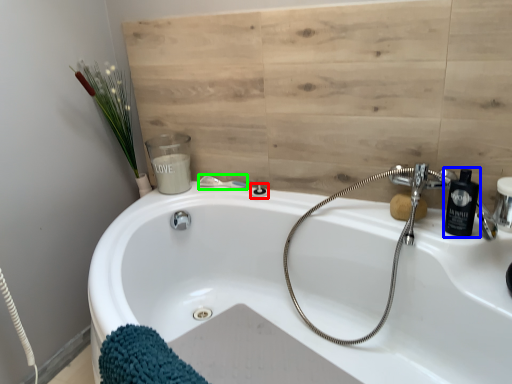
Question: Considering the real-world distances, which object is farthest from shower (highlighted by a red box)? soap dispenser (highlighted by a blue box) or shower (highlighted by a green box)?

Choices:
 (A) soap dispenser
 (B) shower

Answer: (A)